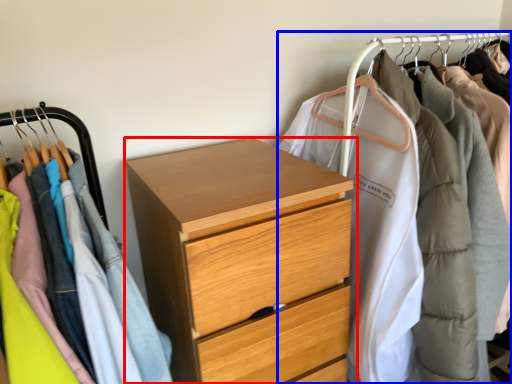
Question: Which point is further to the camera, chest of drawers (highlighted by a red box) or closet (highlighted by a blue box)?

Choices:
 (A) chest of drawers
 (B) closet

Answer: (A)